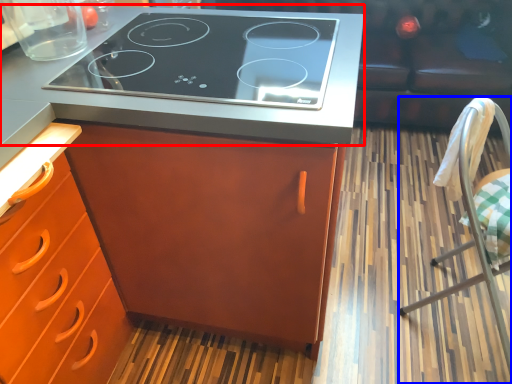
Question: Which object is closer to the camera taking this photo, countertop (highlighted by a red box) or chair (highlighted by a blue box)?

Choices:
 (A) countertop
 (B) chair

Answer: (B)